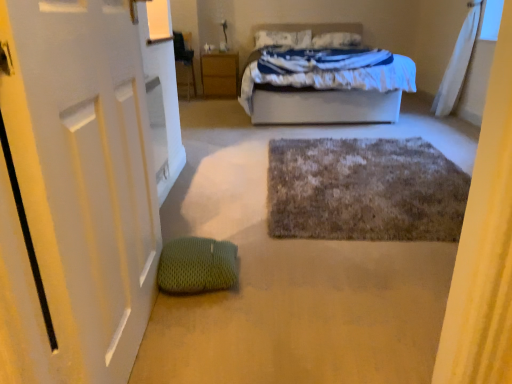
Locate an element on the screen. free area in between white matte door at left and fuzzy gray bath mat at center is located at coordinates (303, 266).